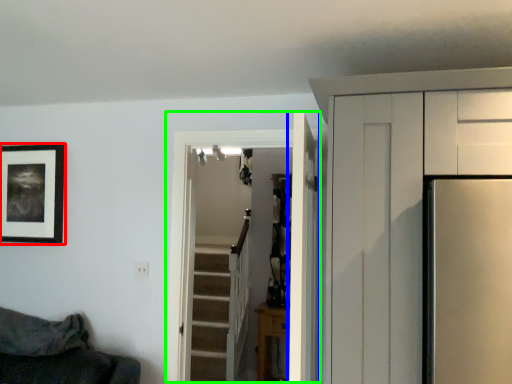
Question: Which object is positioned farthest from picture frame (highlighted by a red box)? Select from door (highlighted by a blue box) and door (highlighted by a green box).

Choices:
 (A) door
 (B) door

Answer: (A)